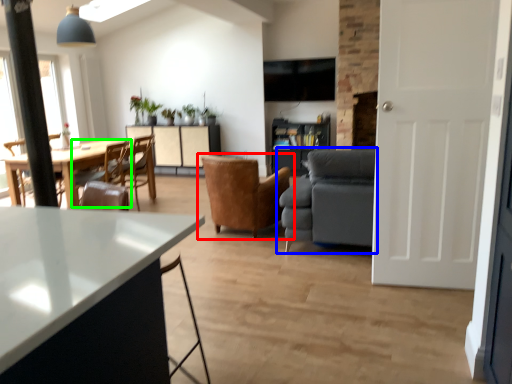
Question: Which object is the closest to the chair (highlighted by a red box)? Choose among these: studio couch (highlighted by a blue box) or chair (highlighted by a green box).

Choices:
 (A) studio couch
 (B) chair

Answer: (A)